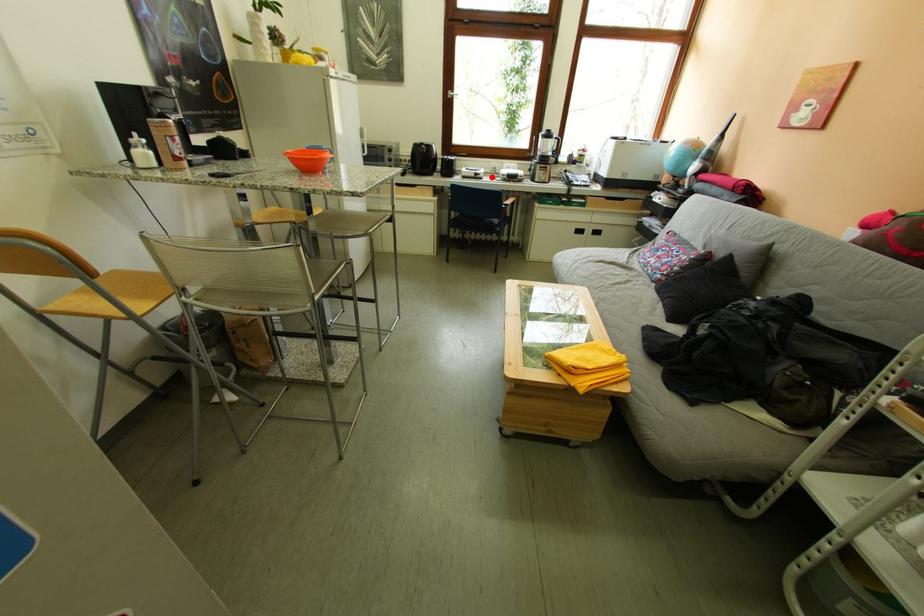
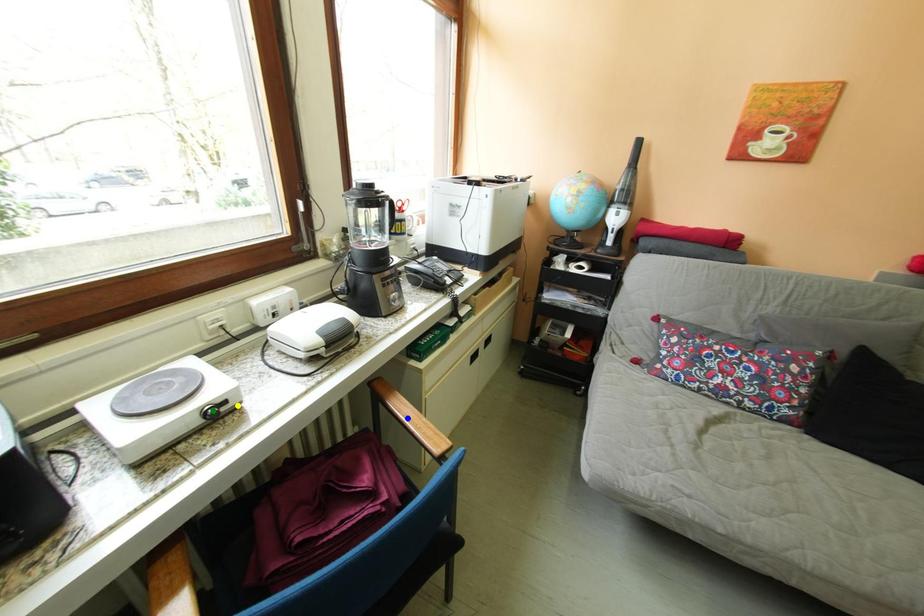
Question: I am providing you with two images of the same scene from different viewpoints. A red point is marked on the first image. You are given multiple points on the second image. Which point in image 2 is actually the same real-world point as the red point in image 1?

Choices:
 (A) blue point
 (B) yellow point
 (C) green point

Answer: (B)